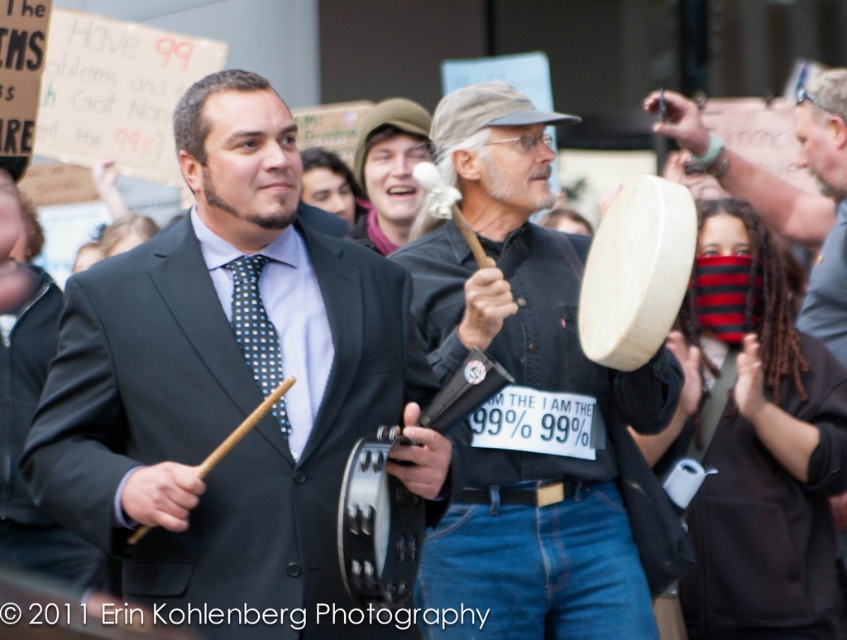
You are a photographer trying to capture a photo of the matte black suit at center and the wooden drum at center. Which object should you focus on first if you want to include both in your frame without moving the camera?

The matte black suit at center is positioned on the left side of the wooden drum at center, so you should focus on the matte black suit at center first to ensure both are in frame without moving the camera.

You are a photographer trying to capture both the wooden drum at center and the green fabric hat at center in the same frame. Based on their sizes, which object should you focus on to ensure both fit in the photo?

The wooden drum at center might be wider than the green fabric hat at center, so focusing on the wooden drum at center would help ensure both fit in the photo as it is likely the larger object.